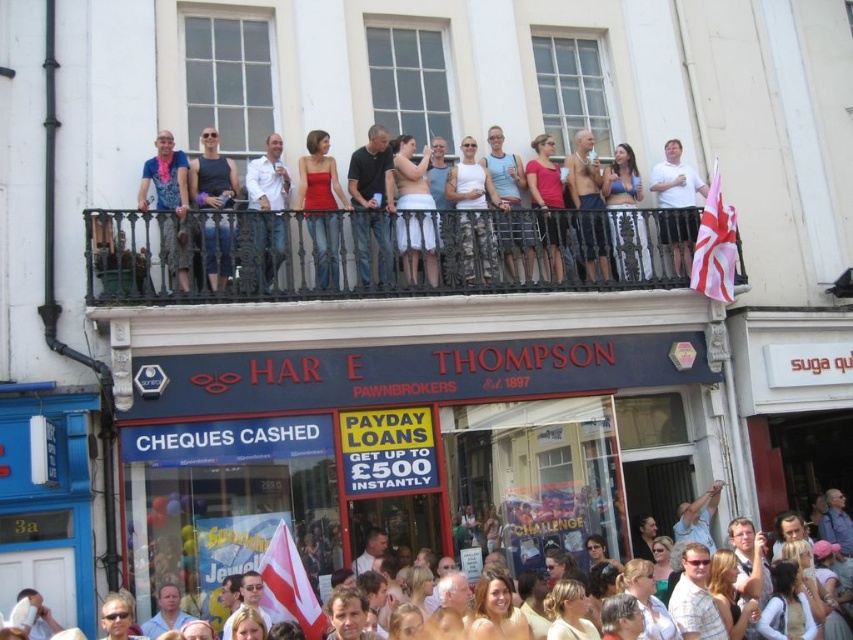
You are a window cleaner standing on the ground in front of the pawnbroker shop. You need to clean the black wrought iron balcony at upper center. Given that your ladder can extend up to 40 meters, will you be able to reach the balcony?

The black wrought iron balcony at upper center is 45.89 meters from viewer, which is higher than the ladder can extend. Therefore, you cannot reach it with the current ladder.

You are a painter who needs to set up an easel. You have two objects in view, the black wrought iron balcony at upper center and the matte black tank top at center. Which object should you stand closer to if you want to paint the entire scene without moving your easel?

You should stand closer to the matte black tank top at center because it is closer to you than the black wrought iron balcony at upper center, allowing you to capture the entire scene without moving the easel.